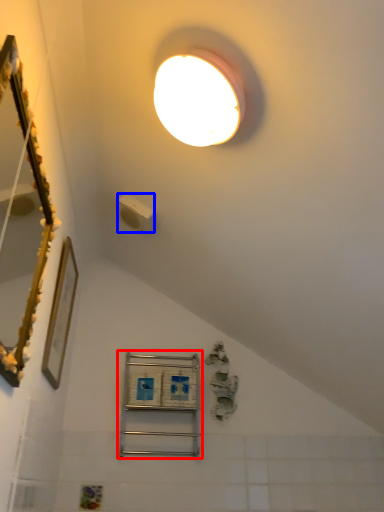
Question: Which object appears farthest to the camera in this image, shelf (highlighted by a red box) or light switch (highlighted by a blue box)?

Choices:
 (A) shelf
 (B) light switch

Answer: (A)